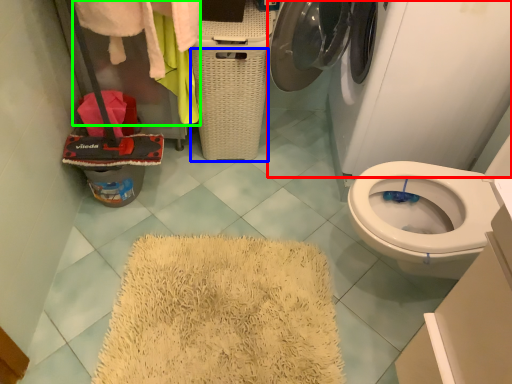
Question: Which object is the closest to the washing machine (highlighted by a red box)? Choose among these: basket (highlighted by a blue box) or clothing (highlighted by a green box).

Choices:
 (A) basket
 (B) clothing

Answer: (A)